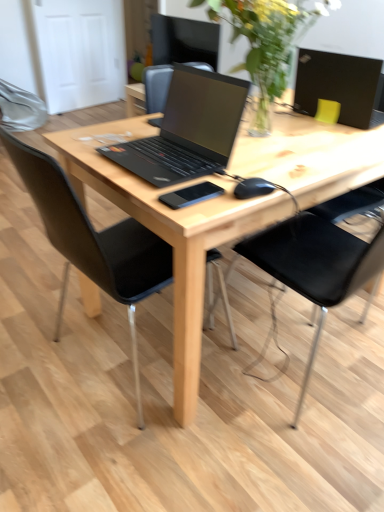
Question: Does black matte laptop at upper right, the first laptop when ordered from back to front, come in front of black matte phone at center?

Choices:
 (A) yes
 (B) no

Answer: (B)

Question: From the image's perspective, is black matte laptop at upper right, placed as the 2th laptop when sorted from left to right, above black matte phone at center?

Choices:
 (A) yes
 (B) no

Answer: (A)

Question: Can you confirm if black matte laptop at upper right, placed as the 2th laptop when sorted from left to right, is positioned to the right of black matte phone at center?

Choices:
 (A) yes
 (B) no

Answer: (A)

Question: Can you confirm if black matte laptop at upper right, arranged as the first laptop when viewed from the right, is smaller than black matte phone at center?

Choices:
 (A) no
 (B) yes

Answer: (A)

Question: Considering the relative sizes of black matte laptop at upper right, placed as the 2th laptop when sorted from left to right, and black matte phone at center in the image provided, is black matte laptop at upper right, placed as the 2th laptop when sorted from left to right, bigger than black matte phone at center?

Choices:
 (A) yes
 (B) no

Answer: (A)

Question: Is black matte laptop at upper right, arranged as the first laptop when viewed from the right, at the left side of black matte phone at center?

Choices:
 (A) yes
 (B) no

Answer: (B)

Question: Is black matte mouse at center completely or partially inside natural wood desk at center?

Choices:
 (A) no
 (B) yes

Answer: (A)

Question: Is natural wood desk at center oriented away from black matte mouse at center?

Choices:
 (A) no
 (B) yes

Answer: (A)

Question: From the image's perspective, does natural wood desk at center appear lower than black matte mouse at center?

Choices:
 (A) yes
 (B) no

Answer: (A)

Question: From the image's perspective, does natural wood desk at center appear higher than black matte mouse at center?

Choices:
 (A) no
 (B) yes

Answer: (A)

Question: Considering the relative sizes of natural wood desk at center and black matte mouse at center in the image provided, is natural wood desk at center shorter than black matte mouse at center?

Choices:
 (A) no
 (B) yes

Answer: (A)

Question: Is natural wood desk at center bigger than black matte mouse at center?

Choices:
 (A) yes
 (B) no

Answer: (A)

Question: From a real-world perspective, is black leather chair at center, acting as the 2th chair starting from the left, positioned under black leather chair at center, which is counted as the 2th chair, starting from the right, based on gravity?

Choices:
 (A) no
 (B) yes

Answer: (A)